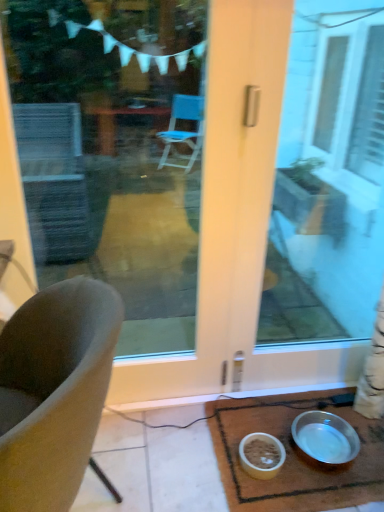
You are a GUI agent. You are given a task and a screenshot of the screen. Output one action in this format:
    pyautogui.click(x=<x>, y=<y>)
    Task: Click on the vacant space that is in between matte brown bowl at lower center, arranged as the second bowl when viewed from the right, and silver metallic bowl at lower right, the 2th bowl in the left-to-right sequence
    The height and width of the screenshot is (512, 384).
    Given the screenshot: What is the action you would take?
    pyautogui.click(x=284, y=456)